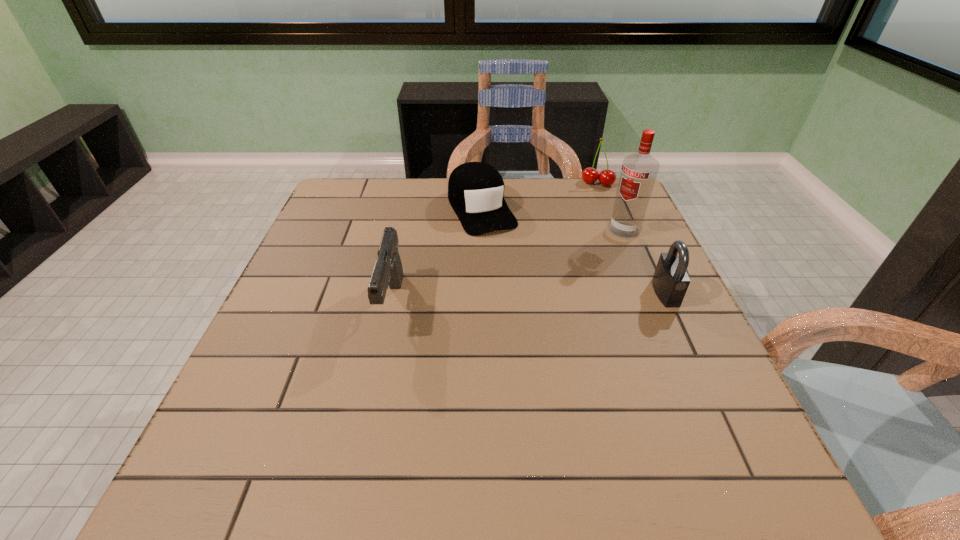
You are a GUI agent. You are given a task and a screenshot of the screen. Output one action in this format:
    pyautogui.click(x=<x>, y=<y>)
    Task: Click on the pistol
    The height and width of the screenshot is (540, 960).
    Given the screenshot: What is the action you would take?
    pyautogui.click(x=388, y=271)

Where is `padlock`? The width and height of the screenshot is (960, 540). padlock is located at coordinates (671, 279).

You are a GUI agent. You are given a task and a screenshot of the screen. Output one action in this format:
    pyautogui.click(x=<x>, y=<y>)
    Task: Click on the tallest object
    The height and width of the screenshot is (540, 960).
    Given the screenshot: What is the action you would take?
    pyautogui.click(x=639, y=171)

Image resolution: width=960 pixels, height=540 pixels. Identify the location of cherry. pos(590,175).

Locate an element on the screen. Image resolution: width=960 pixels, height=540 pixels. the fourth object from right to left is located at coordinates (475, 189).

Identify the location of the shortest object. The width and height of the screenshot is (960, 540). (475, 189).

Identify the location of vacant region located 0.050m aim along the barrel of the leftmost object. This screenshot has height=540, width=960. (381, 360).

I want to click on free spot located on the front label of the tallest object, so click(575, 270).

Image resolution: width=960 pixels, height=540 pixels. What are the coordinates of `free location located on the front label of the tallest object` in the screenshot? It's located at (542, 297).

Where is `vacant space situated 0.210m on the front label of the tallest object`? Image resolution: width=960 pixels, height=540 pixels. vacant space situated 0.210m on the front label of the tallest object is located at coordinates [570, 274].